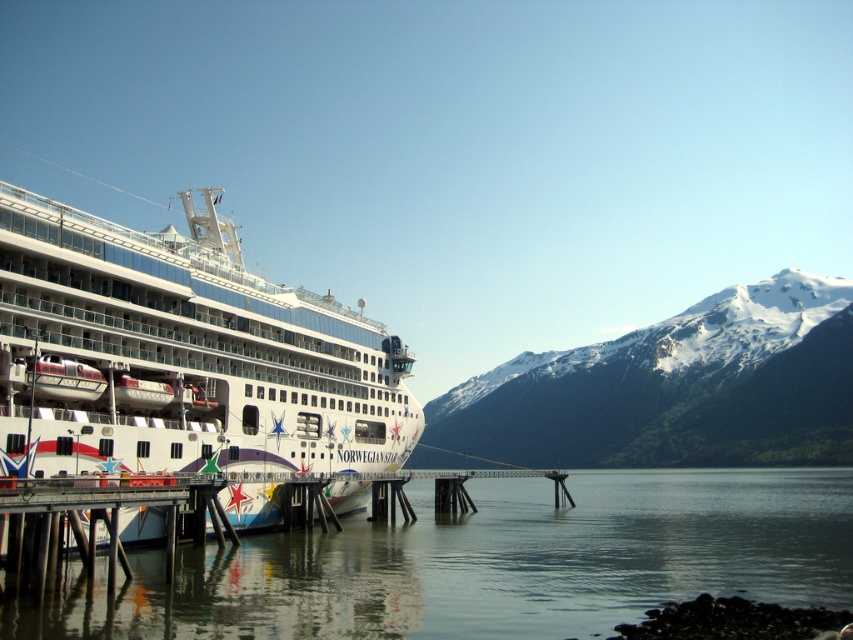
How distant is clear water at lower left from snowy rocky mountain at right?

The distance of clear water at lower left from snowy rocky mountain at right is 166.99 meters.

Is clear water at lower left wider than snowy rocky mountain at right?

No.

Locate an element on the screen. This screenshot has height=640, width=853. clear water at lower left is located at coordinates (486, 563).

Locate an element on the screen. clear water at lower left is located at coordinates (486, 563).

Does clear water at lower left appear on the left side of white glossy cruise ship at left?

Incorrect, clear water at lower left is not on the left side of white glossy cruise ship at left.

Which is in front, point (254, 605) or point (148, 451)?

Point (254, 605)

Between point (62, 634) and point (67, 275), which one is positioned behind?

Positioned behind is point (67, 275).

Find the location of a particular element. clear water at lower left is located at coordinates (486, 563).

Is white glossy cruise ship at left taller than snowy rocky mountain at right?

No.

In order to click on white glossy cruise ship at left in this screenshot , I will do `click(180, 356)`.

Locate an element on the screen. white glossy cruise ship at left is located at coordinates (180, 356).